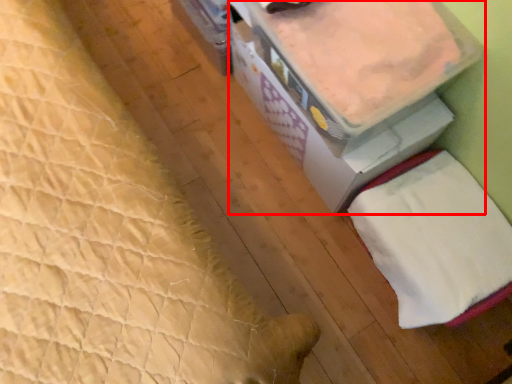
Question: From the image's perspective, where is storage box (annotated by the red box) located relative to sheet?

Choices:
 (A) above
 (B) below

Answer: (A)